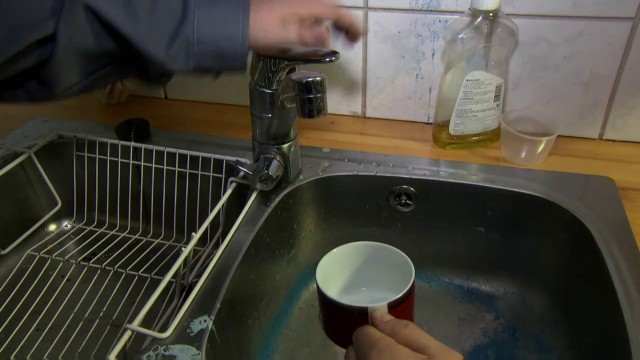
Locate an element on the screen. This screenshot has height=360, width=640. handle is located at coordinates (386, 328).